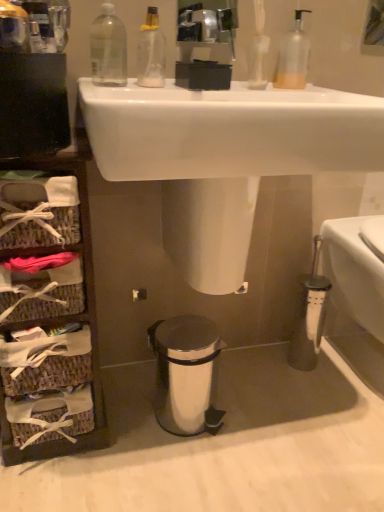
Identify the location of vacant space that's between woven brown basket at left and silver metallic trash can at lower center. (132, 411).